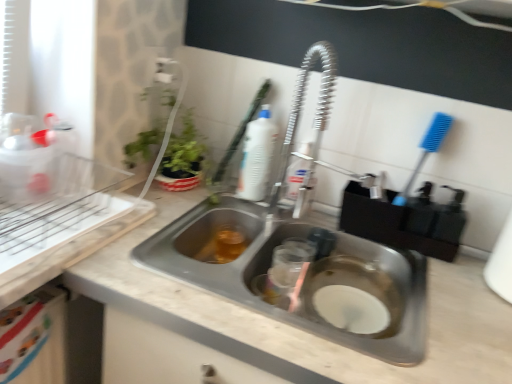
Question: Is translucent amber liquid at sink left thinner than metallic stainless steel sink at center?

Choices:
 (A) yes
 (B) no

Answer: (A)

Question: Is translucent amber liquid at sink left further to camera compared to metallic stainless steel sink at center?

Choices:
 (A) no
 (B) yes

Answer: (B)

Question: Is translucent amber liquid at sink left closer to the viewer compared to metallic stainless steel sink at center?

Choices:
 (A) yes
 (B) no

Answer: (B)

Question: Is the surface of translucent amber liquid at sink left in direct contact with metallic stainless steel sink at center?

Choices:
 (A) yes
 (B) no

Answer: (B)

Question: Considering the relative sizes of translucent amber liquid at sink left and metallic stainless steel sink at center in the image provided, is translucent amber liquid at sink left taller than metallic stainless steel sink at center?

Choices:
 (A) no
 (B) yes

Answer: (A)

Question: Is point (262, 99) positioned closer to the camera than point (253, 153)?

Choices:
 (A) closer
 (B) farther

Answer: (B)

Question: Is white plastic brush at upper center to the left or to the right of white plastic bottle at upper center, the second cleaning product positioned from the right, in the image?

Choices:
 (A) left
 (B) right

Answer: (A)

Question: Is white plastic brush at upper center inside or outside of white plastic bottle at upper center, which is the 1th cleaning product in left-to-right order?

Choices:
 (A) inside
 (B) outside

Answer: (B)

Question: Relative to white plastic bottle at upper center, which is the 1th cleaning product in left-to-right order, is white plastic brush at upper center in front or behind?

Choices:
 (A) front
 (B) behind

Answer: (A)

Question: In terms of size, does white plastic brush at upper center appear bigger or smaller than stainless steel sink at center?

Choices:
 (A) small
 (B) big

Answer: (A)

Question: Is white plastic brush at upper center spatially inside stainless steel sink at center, or outside of it?

Choices:
 (A) inside
 (B) outside

Answer: (B)

Question: From the image's perspective, relative to stainless steel sink at center, is white plastic brush at upper center above or below?

Choices:
 (A) above
 (B) below

Answer: (A)

Question: Considering the positions of white plastic brush at upper center and stainless steel sink at center in the image, is white plastic brush at upper center taller or shorter than stainless steel sink at center?

Choices:
 (A) short
 (B) tall

Answer: (A)

Question: Choose the correct answer: Is white plastic bottle at upper center, the second cleaning product positioned from the right, inside metallic stainless steel sink at center or outside it?

Choices:
 (A) outside
 (B) inside

Answer: (A)

Question: Would you say white plastic bottle at upper center, the second cleaning product positioned from the right, is to the left or to the right of metallic stainless steel sink at center in the picture?

Choices:
 (A) right
 (B) left

Answer: (B)